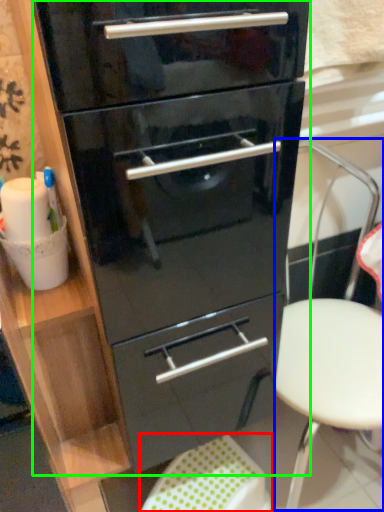
Question: Which object is the farthest from step stool (highlighted by a red box)? Choose among these: folding chair (highlighted by a blue box) or chest of drawers (highlighted by a green box).

Choices:
 (A) folding chair
 (B) chest of drawers

Answer: (B)